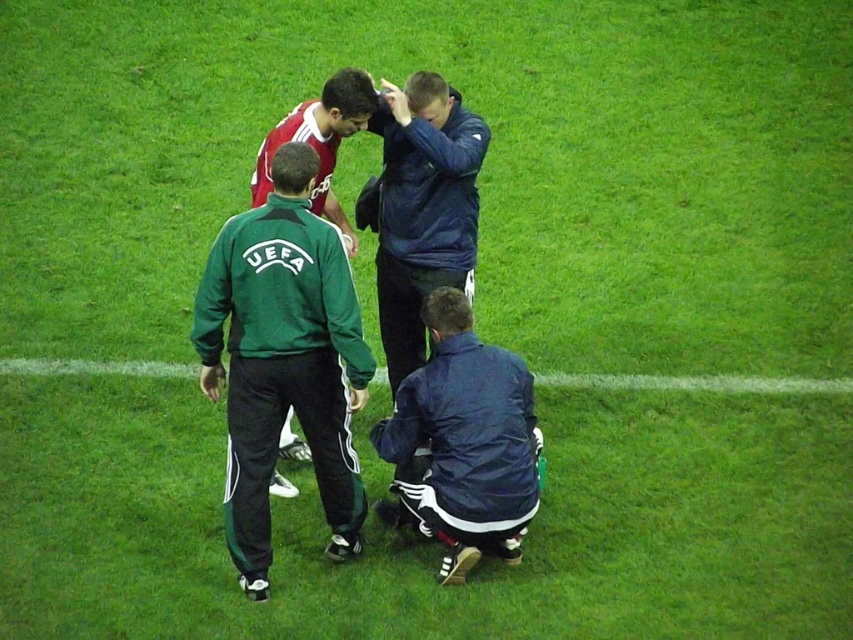
Which of these two, dark blue fabric jacket at lower center or dark blue jacket at center, stands shorter?

dark blue fabric jacket at lower center

Does dark blue fabric jacket at lower center have a lesser height compared to dark blue jacket at center?

Correct, dark blue fabric jacket at lower center is not as tall as dark blue jacket at center.

Between point (482, 552) and point (456, 259), which one is positioned behind?

The point (456, 259) is behind.

The height and width of the screenshot is (640, 853). I want to click on dark blue fabric jacket at lower center, so click(x=462, y=442).

Is dark blue jacket at center positioned in front of red jersey at upper center?

No, dark blue jacket at center is behind red jersey at upper center.

The height and width of the screenshot is (640, 853). What do you see at coordinates (421, 209) in the screenshot? I see `dark blue jacket at center` at bounding box center [421, 209].

This screenshot has width=853, height=640. I want to click on dark blue jacket at center, so [421, 209].

Does dark blue fabric jacket at lower center have a greater width compared to red jersey at upper center?

Indeed, dark blue fabric jacket at lower center has a greater width compared to red jersey at upper center.

Which is more to the right, dark blue fabric jacket at lower center or red jersey at upper center?

dark blue fabric jacket at lower center

Which is behind, point (498, 490) or point (265, 193)?

The point (265, 193) is more distant.

This screenshot has width=853, height=640. Find the location of `dark blue fabric jacket at lower center`. dark blue fabric jacket at lower center is located at coordinates (462, 442).